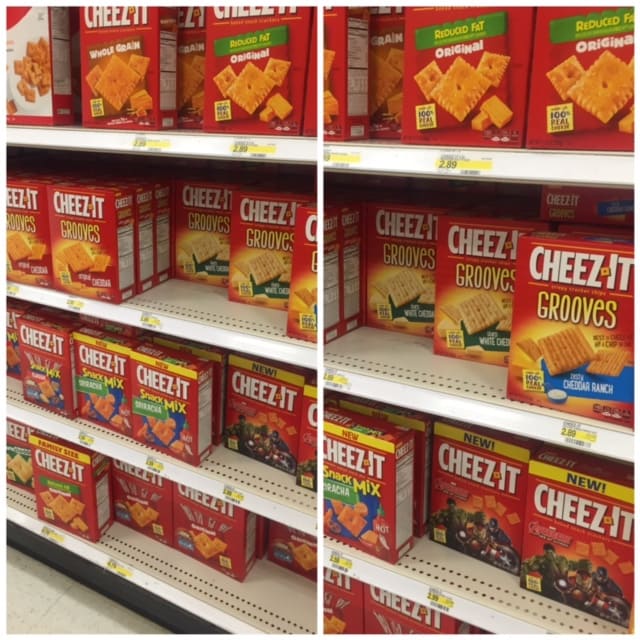
Identify the location of store shelves. (188, 141), (395, 157), (404, 390), (230, 342), (194, 481), (172, 588), (396, 588).